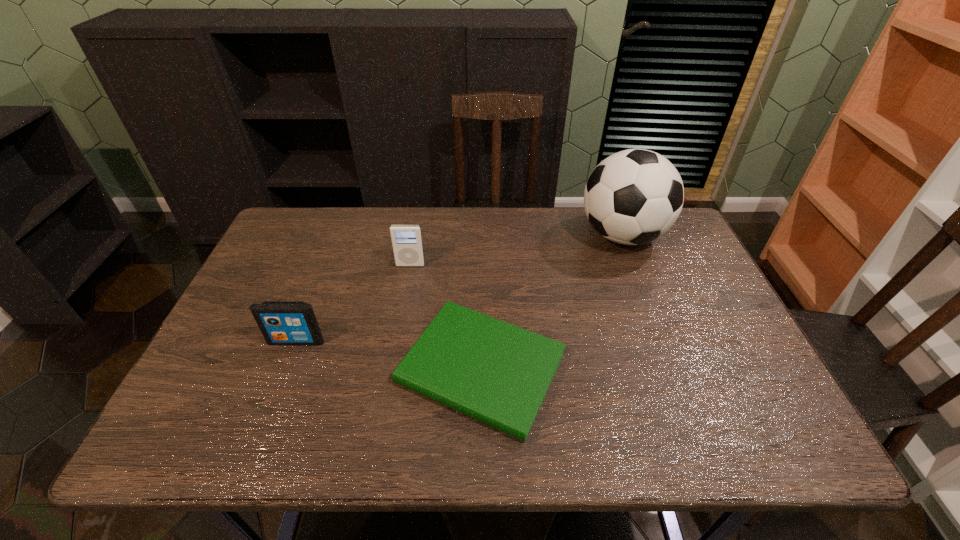
Locate an element on the screen. This screenshot has width=960, height=540. object that stands as the third closest to the shortest object is located at coordinates (634, 196).

Find the location of a particular element. The image size is (960, 540). vacant area in the image that satisfies the following two spatial constraints: 1. on the front screen of the nearer iPod; 2. on the left side of the shortest object is located at coordinates (286, 369).

Locate an element on the screen. This screenshot has height=540, width=960. free spot that satisfies the following two spatial constraints: 1. on the front screen of the paperback book; 2. on the left side of the left iPod is located at coordinates (286, 369).

Identify the location of vacant point that satisfies the following two spatial constraints: 1. on the front-facing side of the paperback book; 2. on the right side of the farther iPod. This screenshot has height=540, width=960. 393,369.

Where is `free location that satisfies the following two spatial constraints: 1. on the front-facing side of the shortest object; 2. on the left side of the right iPod`? The image size is (960, 540). free location that satisfies the following two spatial constraints: 1. on the front-facing side of the shortest object; 2. on the left side of the right iPod is located at coordinates (393, 369).